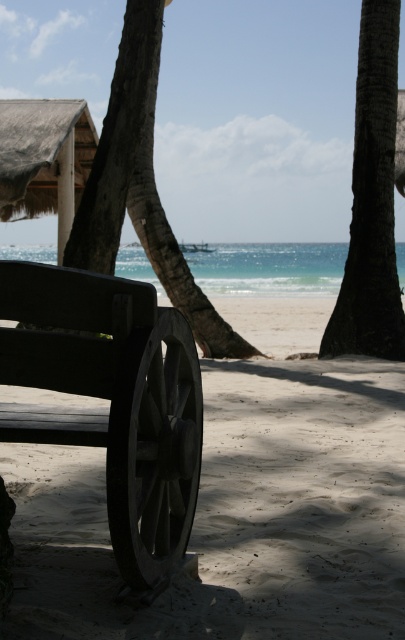
In the scene shown: Can you confirm if sandy beige at lower left is positioned below wooden bench at lower left?

Yes, sandy beige at lower left is below wooden bench at lower left.

Can you confirm if sandy beige at lower left is smaller than wooden bench at lower left?

Actually, sandy beige at lower left might be larger than wooden bench at lower left.

Does point (277, 419) lie behind point (138, 531)?

Yes.

Where is `sandy beige at lower left`? The width and height of the screenshot is (405, 640). sandy beige at lower left is located at coordinates (236, 515).

In the scene shown: Which is more to the right, wooden bench at lower left or dark brown textured palm tree at center?

dark brown textured palm tree at center is more to the right.

In the scene shown: Can you confirm if wooden bench at lower left is taller than dark brown textured palm tree at center?

In fact, wooden bench at lower left may be shorter than dark brown textured palm tree at center.

Which is in front, point (129, 524) or point (338, 294)?

Point (129, 524) is in front.

Identify the location of wooden bench at lower left. (110, 400).

Who is more forward, (259, 401) or (147, 356)?

Point (147, 356)

Image resolution: width=405 pixels, height=640 pixels. What do you see at coordinates (236, 515) in the screenshot? I see `sandy beige at lower left` at bounding box center [236, 515].

Locate an element on the screen. The image size is (405, 640). sandy beige at lower left is located at coordinates (236, 515).